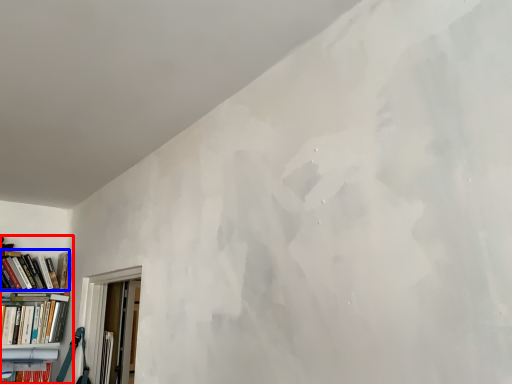
Question: Among these objects, which one is nearest to the camera, bookcase (highlighted by a red box) or book (highlighted by a blue box)?

Choices:
 (A) bookcase
 (B) book

Answer: (A)